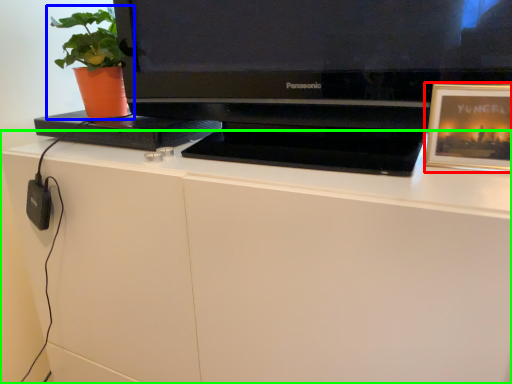
Question: Which object is positioned farthest from picture frame (highlighted by a red box)? Select from houseplant (highlighted by a blue box) and desk (highlighted by a green box).

Choices:
 (A) houseplant
 (B) desk

Answer: (A)